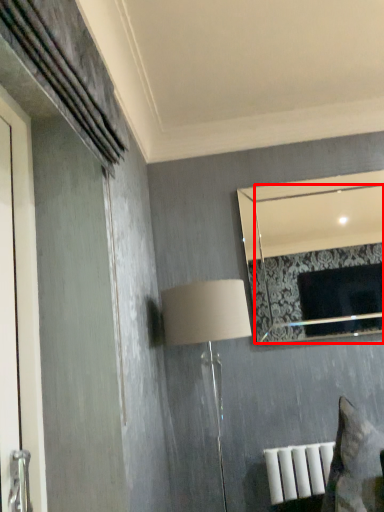
Question: From the image's perspective, what is the correct spatial positioning of mirror (annotated by the red box) in reference to table lamp?

Choices:
 (A) above
 (B) below

Answer: (A)